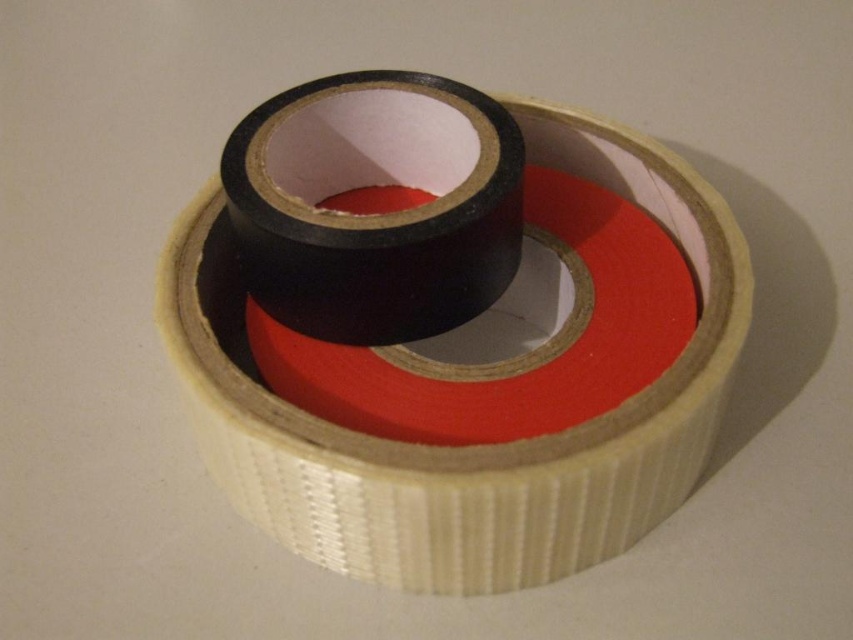
You are organizing a storage room and need to place the black matte tape at center and the matte black tape at center on a shelf. Which tape should you place first on the shelf to match the arrangement shown in the image?

The matte black tape at center should be placed first on the shelf since it is positioned above the black matte tape at center in the image.

You are organizing a storage room and need to place the black matte tape at center and the matte black tape at center on a shelf. The shelf has limited vertical space. Which tape should you place first to ensure both fit vertically?

The matte black tape at center should be placed first since it is shorter than the black matte tape at center, allowing the taller tape to be placed on top without exceeding the shelf height limit.

You are a delivery person who needs to secure a package. You have two rolls of tape available. One is the black matte tape at center and the other is the beige tape below it. The distance between them is 1.20 meters. If you need to reach both rolls to apply tape, can you do so without moving your hands more than 1 meter apart?

The distance between the black matte tape at center and the beige tape below it is 1.20 meters. Since your hands can only move 1 meter apart, you cannot reach both rolls without moving your hands further apart than that distance.